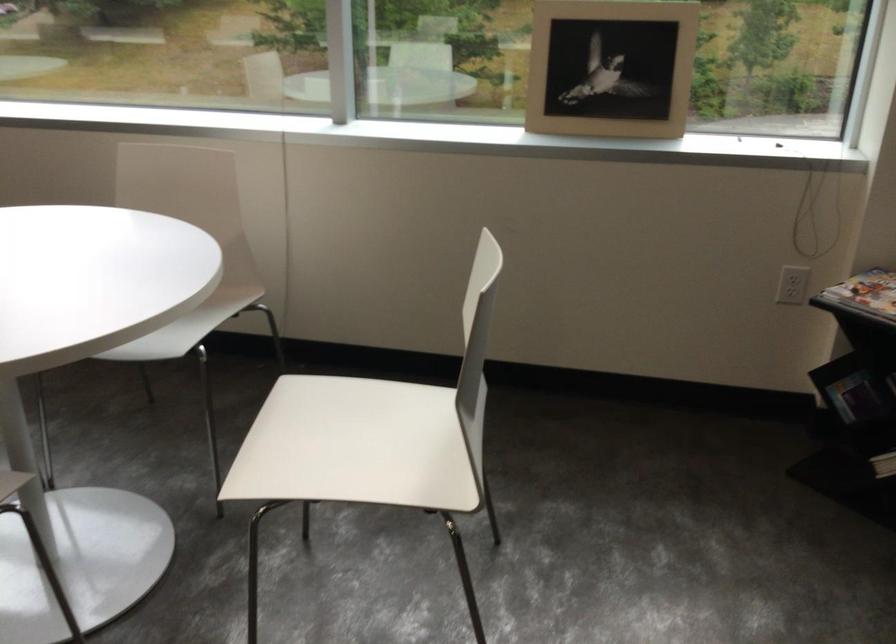
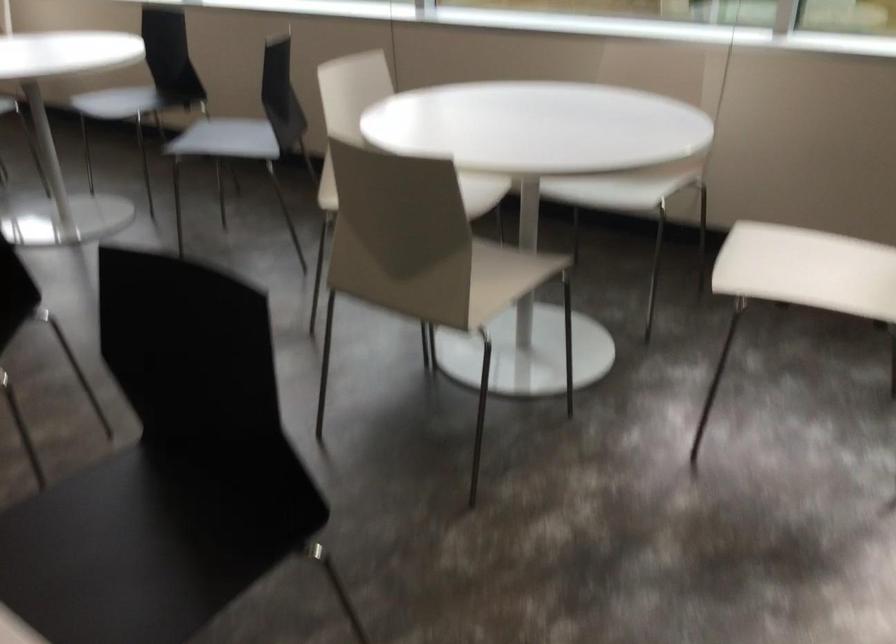
Question: The camera is either moving clockwise (left) or counter-clockwise (right) around the object. The first image is from the beginning of the video and the second image is from the end. Is the camera moving left or right when shooting the video?

Choices:
 (A) Left
 (B) Right

Answer: (B)